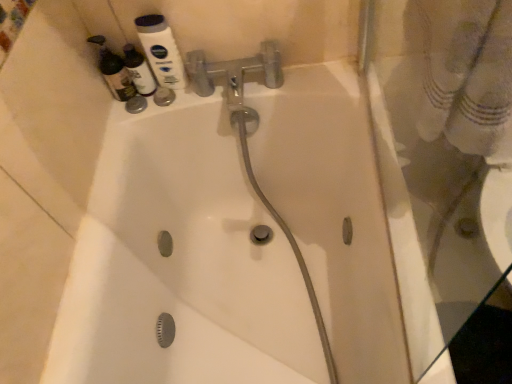
Question: Is white glossy mouthwash at upper left inside the boundaries of matte white bottle at upper left, the second cleaning product when ordered from right to left, or outside?

Choices:
 (A) inside
 (B) outside

Answer: (B)

Question: From a real-world perspective, is white glossy mouthwash at upper left physically located above or below matte white bottle at upper left, the second cleaning product when ordered from right to left?

Choices:
 (A) below
 (B) above

Answer: (B)

Question: Based on their relative distances, which object is nearer to the matte white bottle at upper left, which appears as the first cleaning product when viewed from the right?

Choices:
 (A) white glossy mouthwash at upper left
 (B) matte white bottle at upper left, the second cleaning product when ordered from right to left

Answer: (B)

Question: Which is nearer to the white glossy mouthwash at upper left?

Choices:
 (A) matte white bottle at upper left, the second cleaning product when ordered from right to left
 (B) matte white bottle at upper left, which appears as the first cleaning product when viewed from the right

Answer: (B)